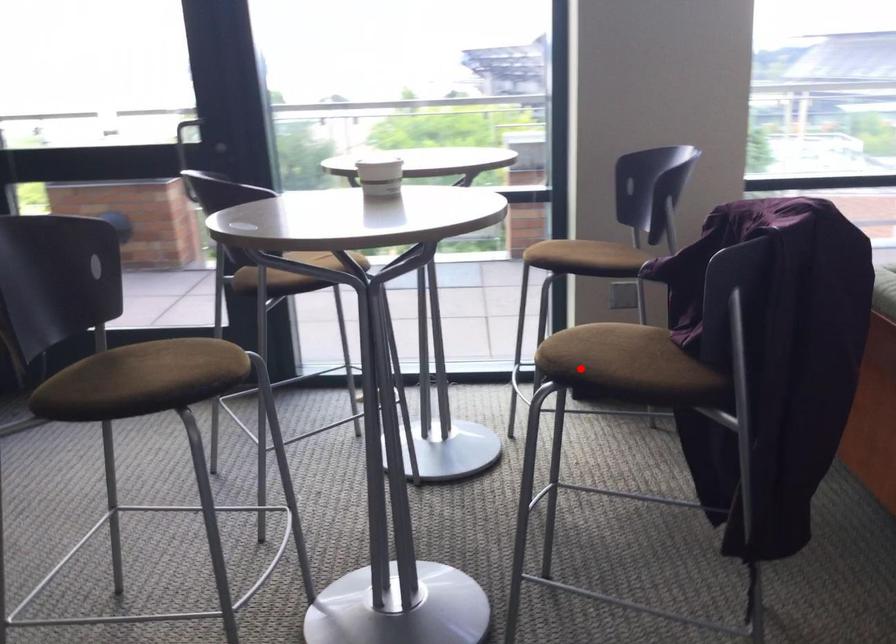
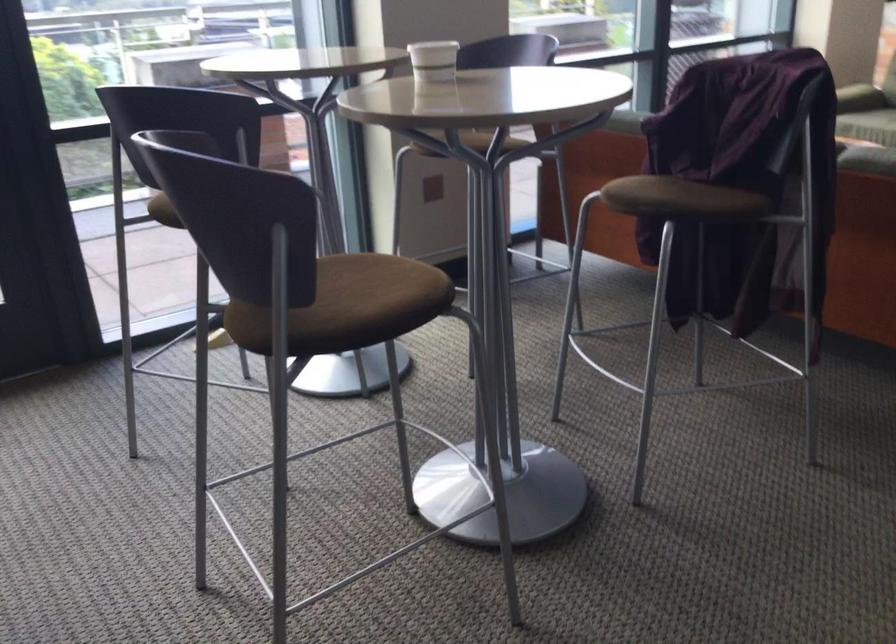
Question: I am providing you with two images of the same scene from different viewpoints. Given a red point in image1, look at the same physical point in image2. Is it:

Choices:
 (A) Closer to the viewpoint
 (B) Farther from the viewpoint

Answer: (B)